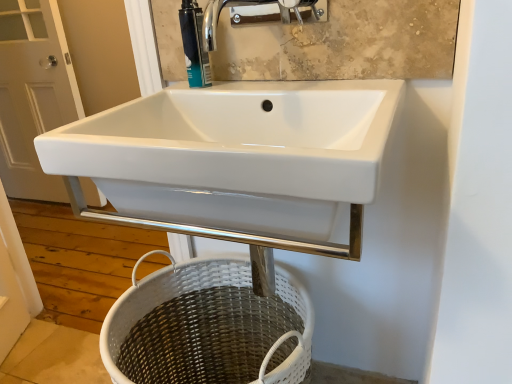
At what (x,y) coordinates should I click in order to perform the action: click on free space to the left of teal plastic soap dispenser at upper center. Please return your answer as a coordinate pair (x, y). Looking at the image, I should click on (154, 97).